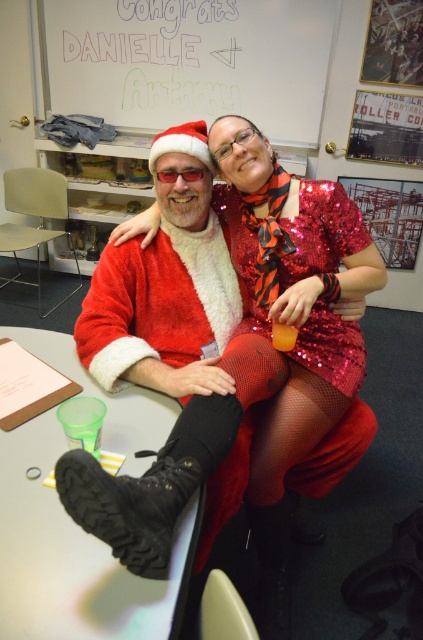
You are a photographer setting up a shoot in this room. You need to position a large backdrop that must be placed behind both the fuzzy red santa suit at center and the shiny sequined dress at center. Given their sizes, which object should the backdrop be sized to accommodate first?

The fuzzy red santa suit at center is larger in size than the shiny sequined dress at center, so the backdrop should first be sized to accommodate the fuzzy red santa suit at center to ensure it covers both properly.

What are the coordinates of the fuzzy red santa suit at center?

The coordinates of the fuzzy red santa suit at center are at point (283, 320).

You are organizing a holiday party and need to decide where to place decorations. The fuzzy red santa suit at center and the whiteboard at upper center are both in the room. Which object takes up more space in the room?

The whiteboard at upper center takes up more space in the room because the fuzzy red santa suit at center is smaller than the whiteboard at upper center.